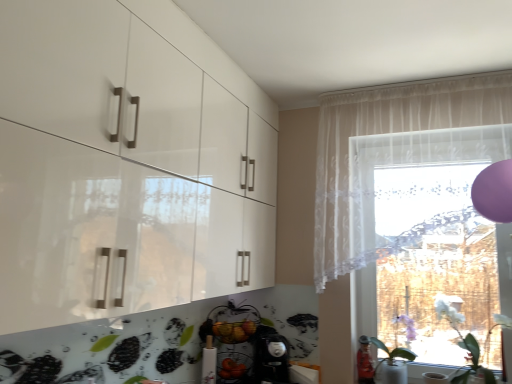
Question: From the image's perspective, is transparent lace curtain at right located above or below white glossy vase at lower right, which ranks as the 2th plant in right-to-left order?

Choices:
 (A) above
 (B) below

Answer: (A)

Question: Do you think transparent lace curtain at right is within white glossy vase at lower right, arranged as the 1th plant when viewed from the left, or outside of it?

Choices:
 (A) outside
 (B) inside

Answer: (A)

Question: Considering the real-world distances, which object is closest to the white glossy vase at lower right, which ranks as the 2th plant in right-to-left order?

Choices:
 (A) transparent lace curtain at right
 (B) white matte plant at lower right, which ranks as the 1th plant in right-to-left order
 (C) sheer white curtain at upper right

Answer: (B)

Question: Which object is the farthest from the white matte plant at lower right, which ranks as the second plant in left-to-right order?

Choices:
 (A) transparent lace curtain at right
 (B) sheer white curtain at upper right
 (C) white glossy vase at lower right, arranged as the 1th plant when viewed from the left

Answer: (B)